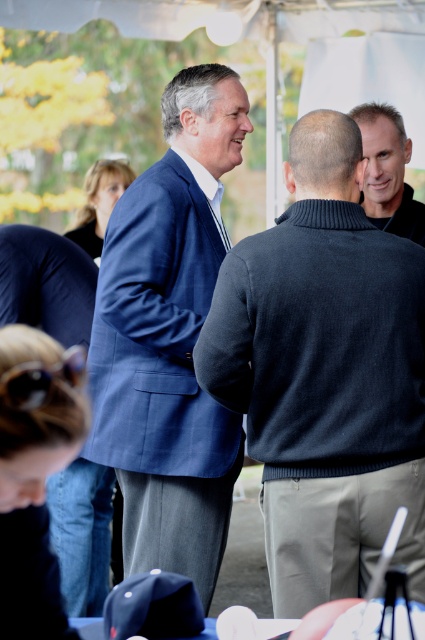
Question: Considering the relative positions of blue wool suit at center and smooth gray sweater at upper right in the image provided, where is blue wool suit at center located with respect to smooth gray sweater at upper right?

Choices:
 (A) below
 (B) above

Answer: (A)

Question: Among these points, which one is farthest from the camera?

Choices:
 (A) (150, 380)
 (B) (393, 228)

Answer: (B)

Question: Based on their relative distances, which object is farther from the blue woolen suit at center?

Choices:
 (A) blue wool suit at center
 (B) smooth gray sweater at upper right

Answer: (B)

Question: Which of these objects is positioned closest to the blue wool suit at center?

Choices:
 (A) blue woolen suit at center
 (B) smooth gray sweater at upper right

Answer: (A)

Question: Can you confirm if blue wool suit at center is bigger than smooth gray sweater at upper right?

Choices:
 (A) no
 (B) yes

Answer: (B)

Question: Is blue woolen suit at center positioned in front of smooth gray sweater at upper right?

Choices:
 (A) no
 (B) yes

Answer: (B)